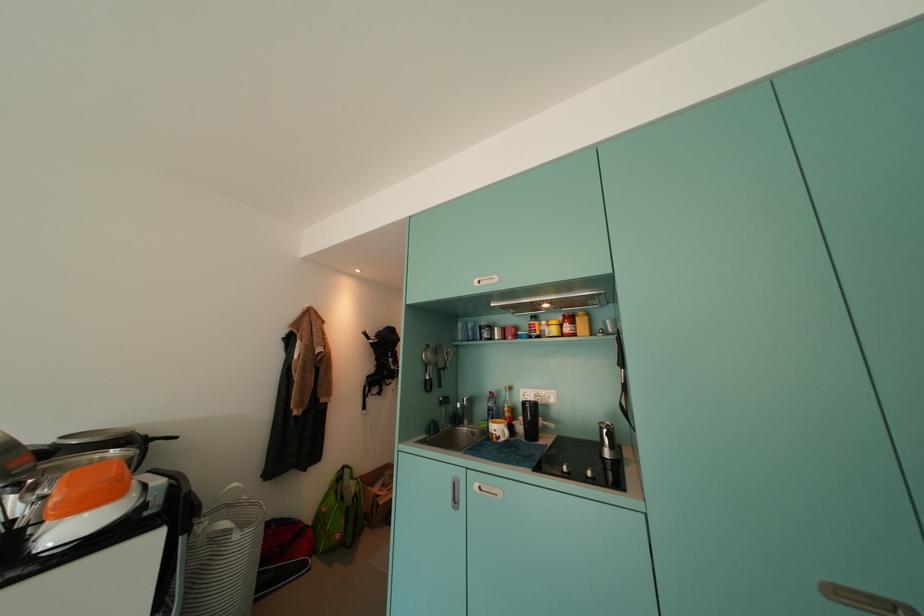
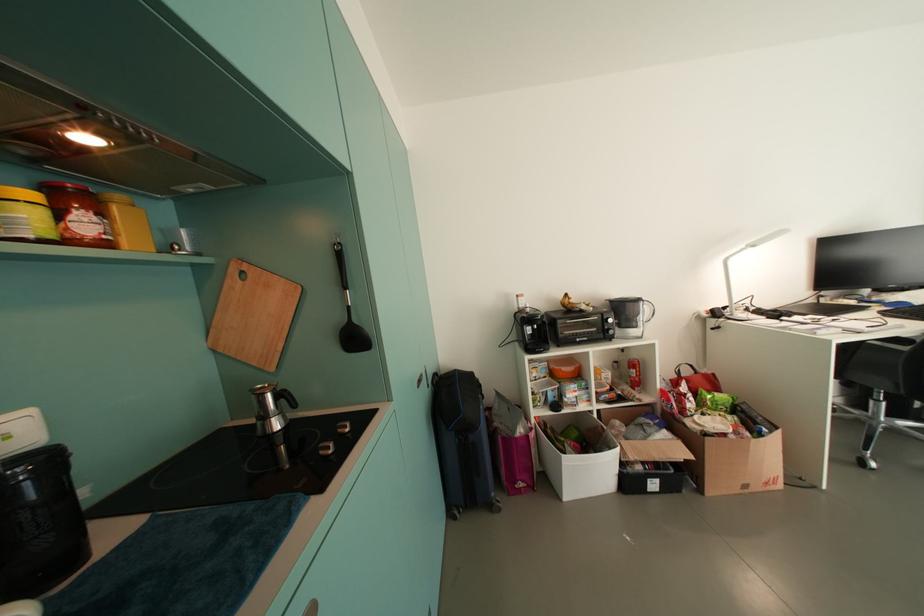
Question: The camera is either moving clockwise (left) or counter-clockwise (right) around the object. The first image is from the beginning of the video and the second image is from the end. Is the camera moving left or right when shooting the video?

Choices:
 (A) Left
 (B) Right

Answer: (A)